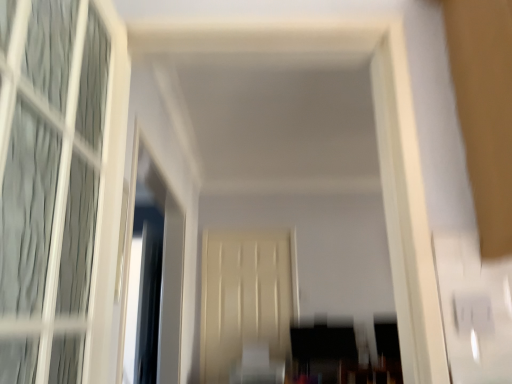
Question: Is clear glass window screen at left in front of or behind beige matte door at center in the image?

Choices:
 (A) behind
 (B) front

Answer: (B)

Question: Is clear glass window screen at left to the left or to the right of beige matte door at center in the image?

Choices:
 (A) right
 (B) left

Answer: (B)

Question: From a real-world perspective, is clear glass window screen at left physically located above or below beige matte door at center?

Choices:
 (A) above
 (B) below

Answer: (A)

Question: Considering the positions of beige matte door at center and clear glass window screen at left in the image, is beige matte door at center taller or shorter than clear glass window screen at left?

Choices:
 (A) tall
 (B) short

Answer: (A)

Question: Looking at the image, does beige matte door at center seem bigger or smaller compared to clear glass window screen at left?

Choices:
 (A) big
 (B) small

Answer: (B)

Question: Considering the relative positions of beige matte door at center and clear glass window screen at left in the image provided, is beige matte door at center to the left or to the right of clear glass window screen at left?

Choices:
 (A) left
 (B) right

Answer: (B)

Question: Is beige matte door at center spatially inside clear glass window screen at left, or outside of it?

Choices:
 (A) inside
 (B) outside

Answer: (B)